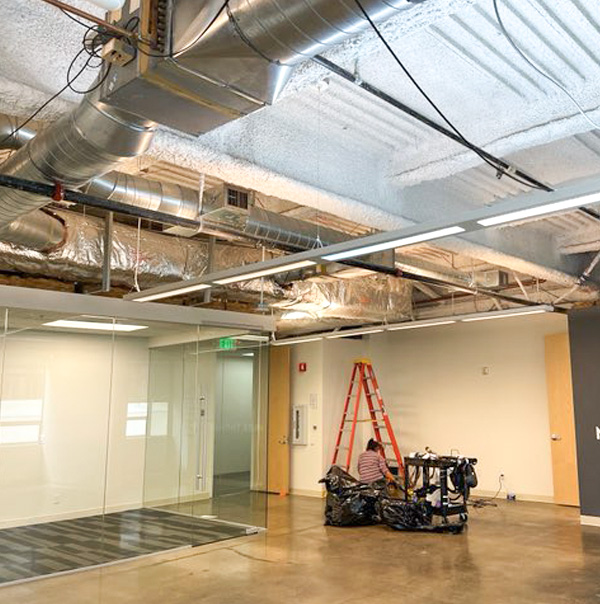
This screenshot has height=604, width=600. In order to click on brown door in this screenshot , I will do `click(566, 448)`.